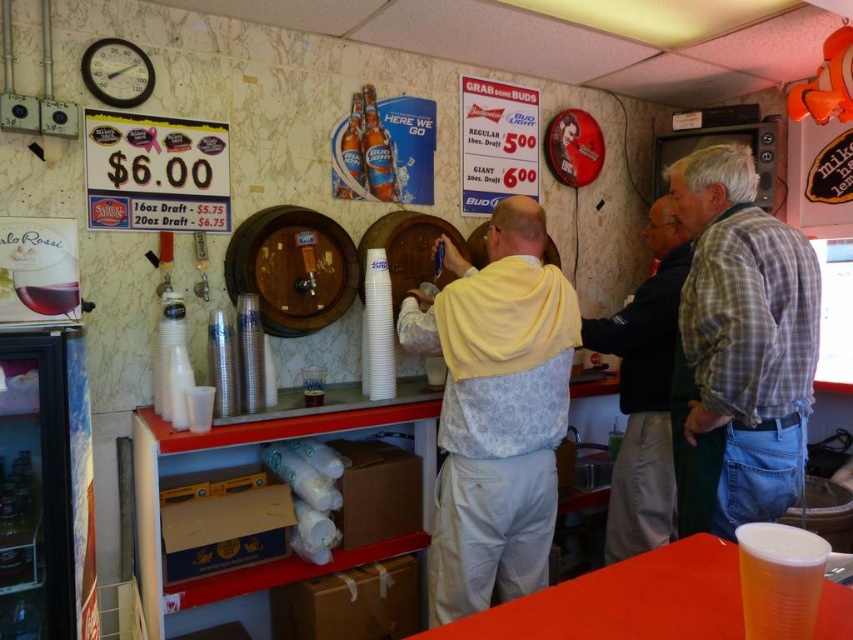
Between light yellow hoodie at center and plaid shirt at right, which one is positioned lower?

light yellow hoodie at center is lower down.

Looking at this image, does light yellow hoodie at center appear on the left side of plaid shirt at right?

No, light yellow hoodie at center is not to the left of plaid shirt at right.

Identify the location of light yellow hoodie at center. The height and width of the screenshot is (640, 853). (738, 348).

Is point (767, 284) closer to camera compared to point (590, 323)?

Yes, it is.

Between point (751, 250) and point (650, 520), which one is positioned behind?

The point (650, 520) is more distant.

Locate an element on the screen. light yellow hoodie at center is located at coordinates (738, 348).

Is light yellow fabric at center positioned before dark gray sweater at center?

Yes, light yellow fabric at center is in front of dark gray sweater at center.

Describe the element at coordinates (496, 410) in the screenshot. I see `light yellow fabric at center` at that location.

Does point (439, 348) come behind point (639, 467)?

No, it is in front of (639, 467).

This screenshot has height=640, width=853. In order to click on light yellow fabric at center in this screenshot , I will do [x=496, y=410].